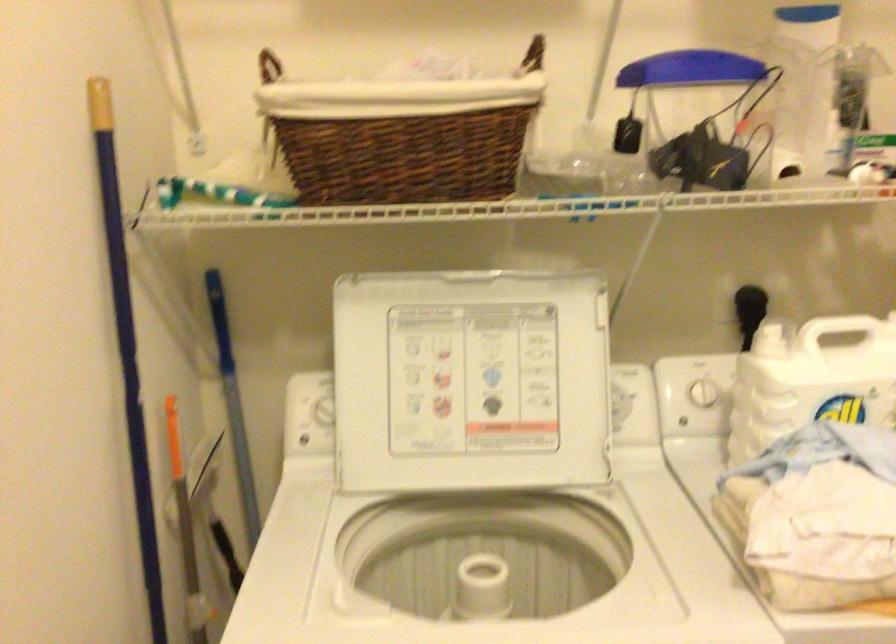
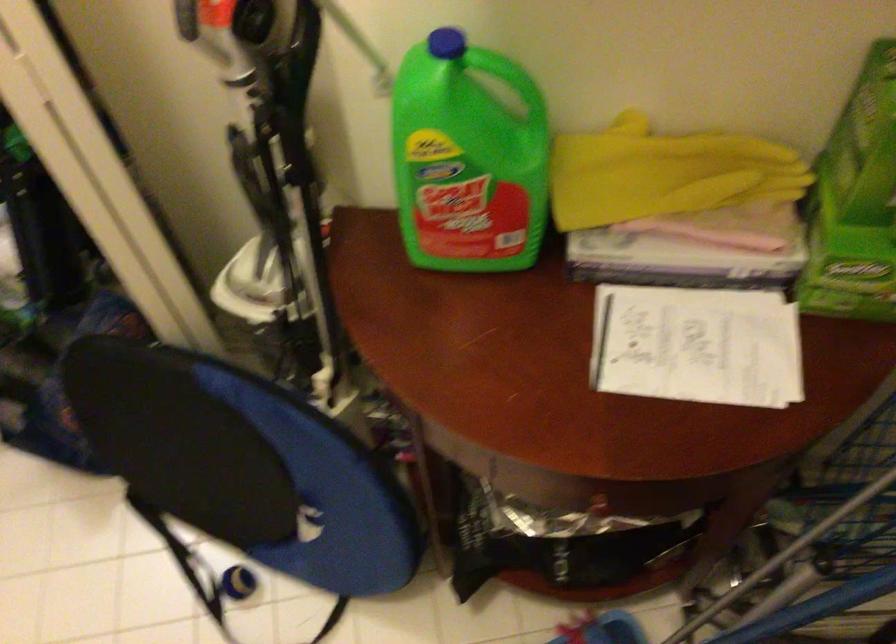
The images are taken continuously from a first-person perspective. In which direction is your viewpoint rotating?

The rotation direction of the camera is right-down.